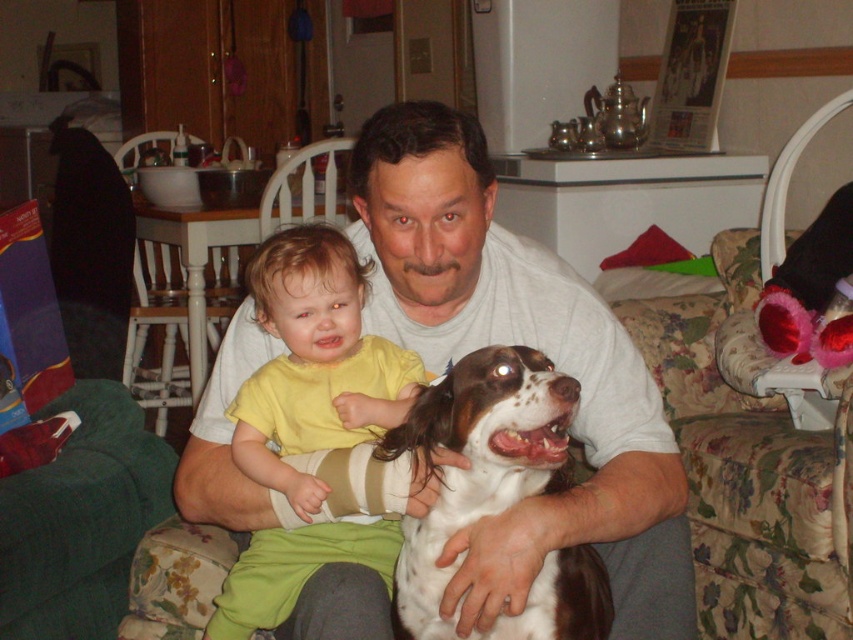
Can you confirm if white speckled fur dog at center is wider than yellow matte shirt at center?

Yes.

Is point (558, 422) farther from viewer compared to point (375, 349)?

No, (558, 422) is closer to viewer.

Image resolution: width=853 pixels, height=640 pixels. What are the coordinates of `white speckled fur dog at center` in the screenshot? It's located at pyautogui.click(x=479, y=461).

Who is more distant from viewer, (202, 468) or (294, 289)?

Point (202, 468)

Between point (428, 326) and point (357, 317), which one is positioned in front?

Point (357, 317)

Where is `white cotton shirt at center`? This screenshot has width=853, height=640. white cotton shirt at center is located at coordinates (523, 342).

Does white cotton shirt at center appear under white speckled fur dog at center?

No, white cotton shirt at center is not below white speckled fur dog at center.

Is white cotton shirt at center further to camera compared to white speckled fur dog at center?

That is True.

Does point (579, 528) come closer to viewer compared to point (523, 636)?

No, (579, 528) is further to viewer.

Identify the location of white cotton shirt at center. The height and width of the screenshot is (640, 853). (523, 342).